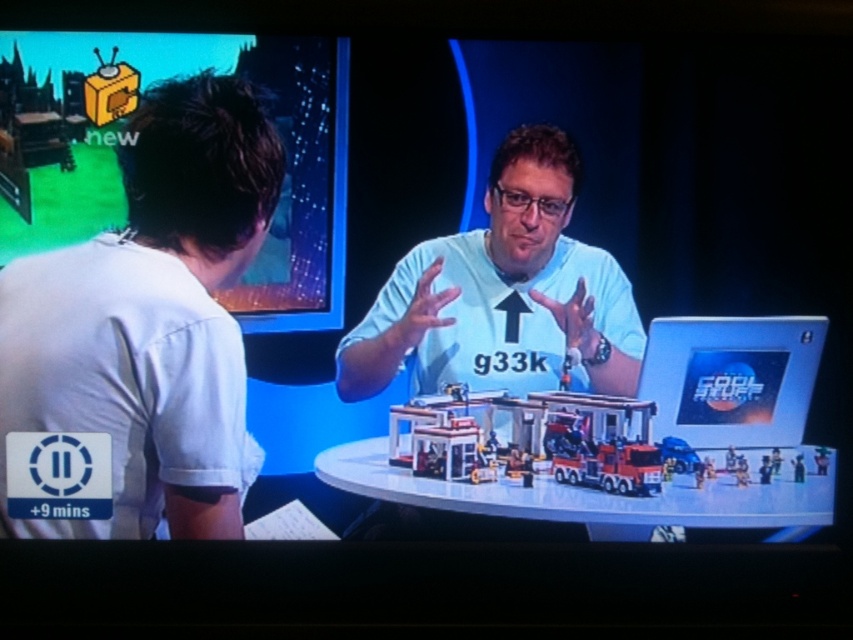
You are a guest on the talk show and need to place a small item on the table without obstructing the camera view. The host mentioned there is a white cotton shirt at left and a plastic toy car at center. Where should you place it?

Place the item near the plastic toy car at center since the white cotton shirt at left is above it, meaning the shirt is closer to the camera and might block the view if placed there.